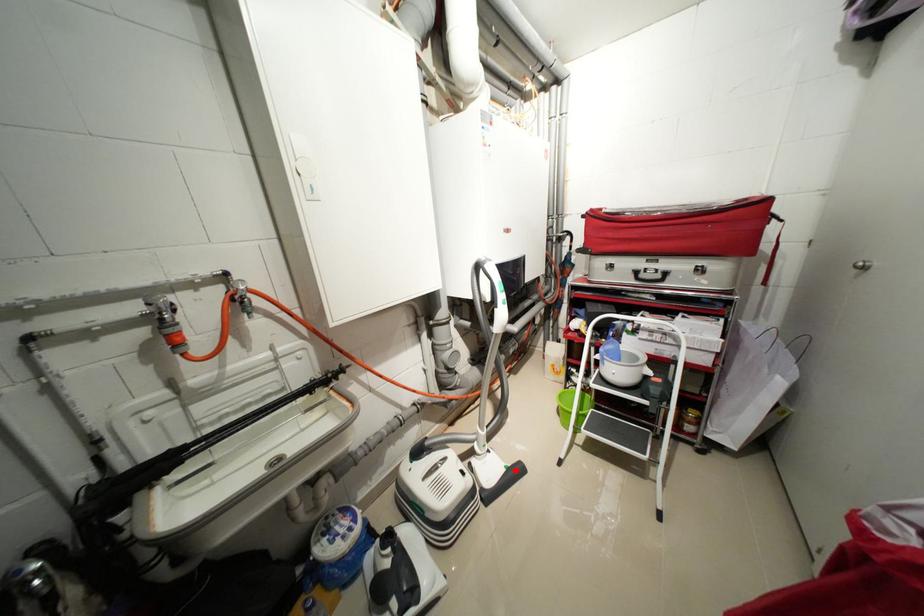
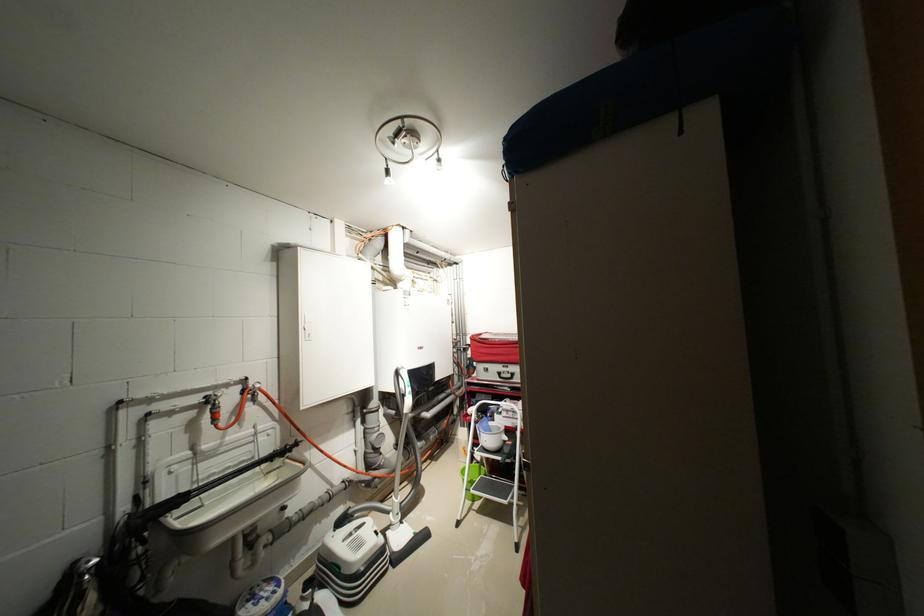
In the second image, find the point that corresponds to the highlighted location in the first image.

(423, 536)